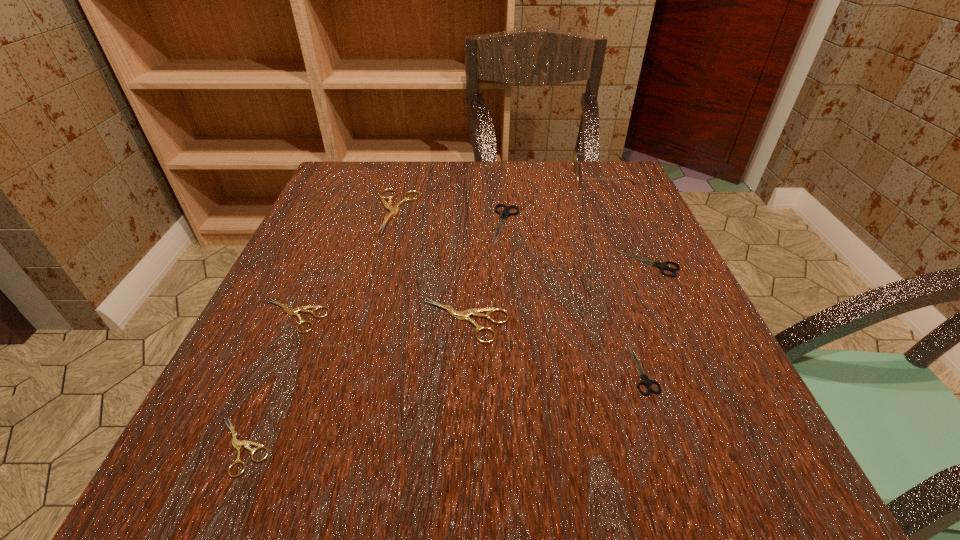
Locate an element on the screen. The width and height of the screenshot is (960, 540). vacant space in between the farthest black shears and the fourth farthest object is located at coordinates (577, 244).

This screenshot has width=960, height=540. Find the location of `vacant area that lies between the fourth farthest object and the third biggest beige shears`. vacant area that lies between the fourth farthest object and the third biggest beige shears is located at coordinates (471, 289).

Where is `free space between the tallest object and the biggest black shears`? The height and width of the screenshot is (540, 960). free space between the tallest object and the biggest black shears is located at coordinates tap(554, 200).

Where is `free space between the biggest black shears and the third smallest beige shears`? This screenshot has width=960, height=540. free space between the biggest black shears and the third smallest beige shears is located at coordinates (486, 273).

This screenshot has height=540, width=960. I want to click on empty location between the farthest object and the sixth farthest shears, so click(622, 273).

In order to click on vacant area that lies between the biggest beige shears and the rightmost beige shears in this screenshot , I will do `click(431, 266)`.

The height and width of the screenshot is (540, 960). Identify the location of empty space that is in between the rightmost shears and the smallest beige shears. (445, 355).

Identify which object is located as the fifth nearest to the shortest shears. Please provide its 2D coordinates. Your answer should be formatted as a tuple, i.e. [(x, y)], where the tuple contains the x and y coordinates of a point satisfying the conditions above.

[(646, 381)]

Select which object appears as the sixth closest to the third object from left to right. Please provide its 2D coordinates. Your answer should be formatted as a tuple, i.e. [(x, y)], where the tuple contains the x and y coordinates of a point satisfying the conditions above.

[(237, 444)]

The image size is (960, 540). Find the location of `shears that is the closest to the nearest object`. shears that is the closest to the nearest object is located at coordinates (304, 309).